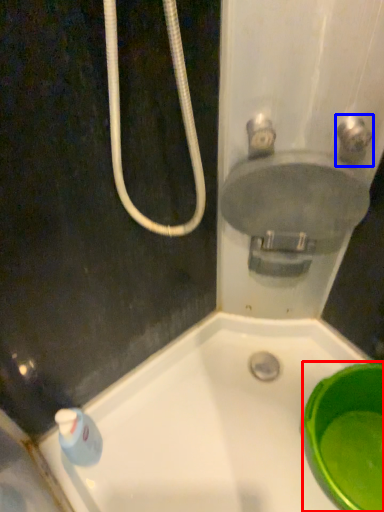
Question: Which object appears farthest to the camera in this image, basin (highlighted by a red box) or plumbing fixture (highlighted by a blue box)?

Choices:
 (A) basin
 (B) plumbing fixture

Answer: (A)